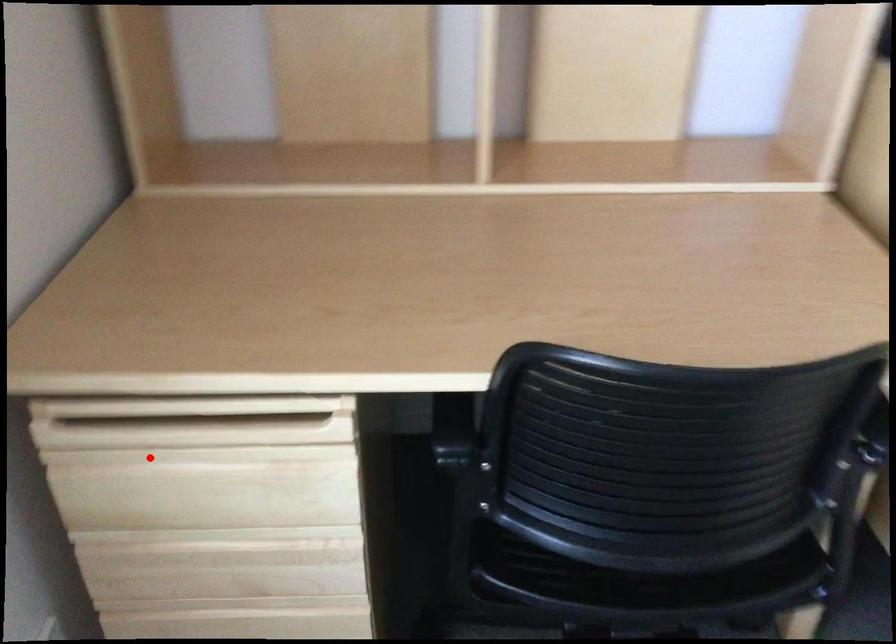
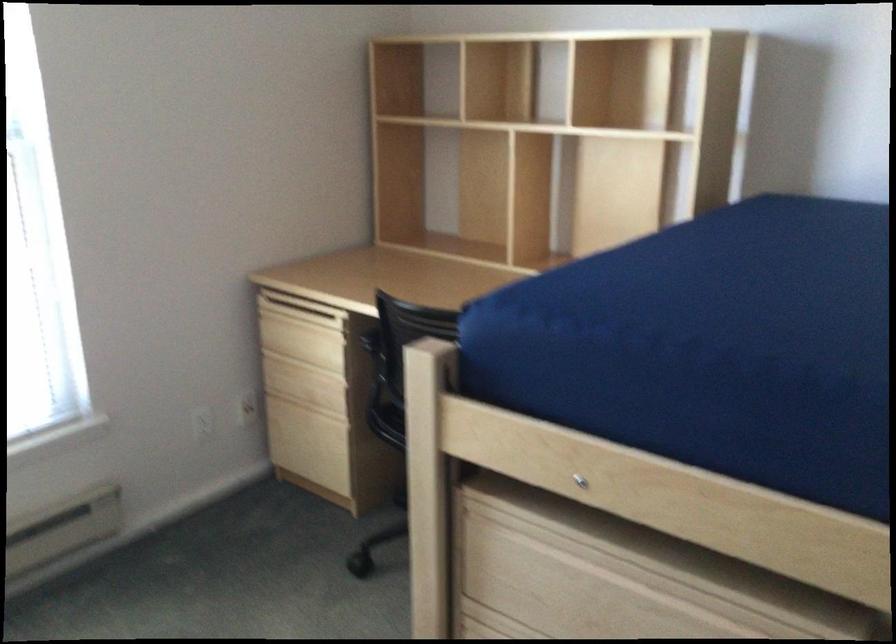
Question: I am providing you with two images of the same scene from different viewpoints. In image1, a red point is highlighted. Considering the same 3D point in image2, which of the following is correct?

Choices:
 (A) It is closer
 (B) It is farther

Answer: (B)